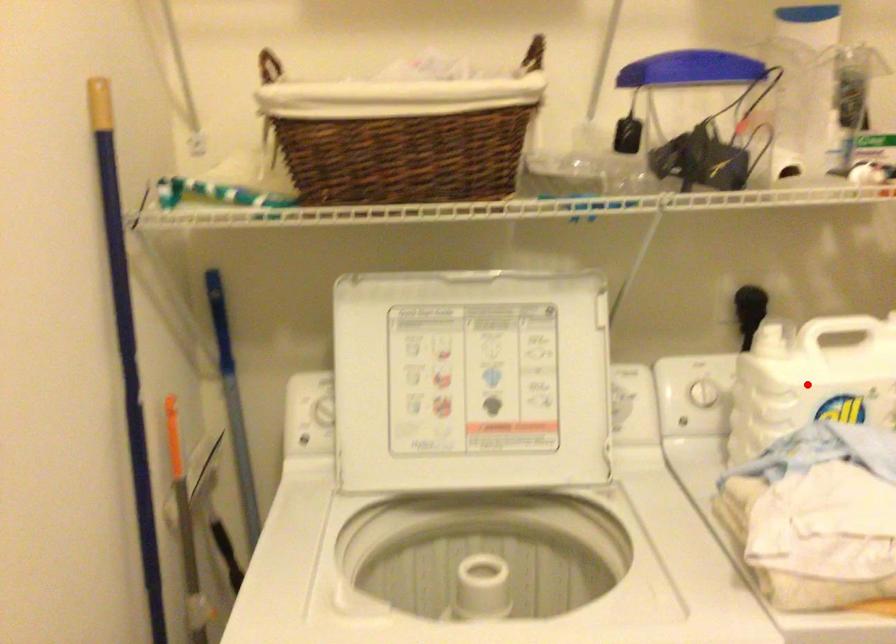
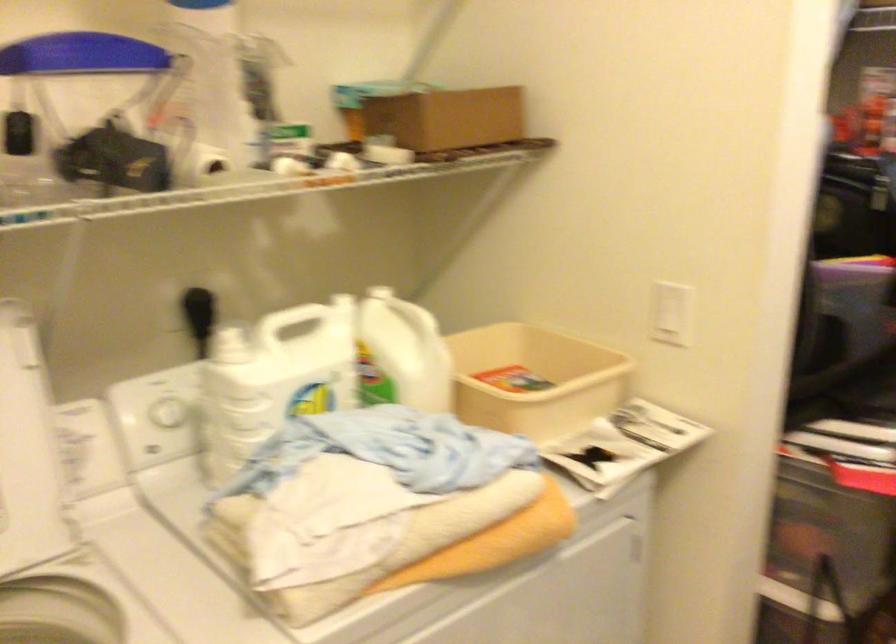
In the second image, find the point that corresponds to the highlighted location in the first image.

(273, 379)